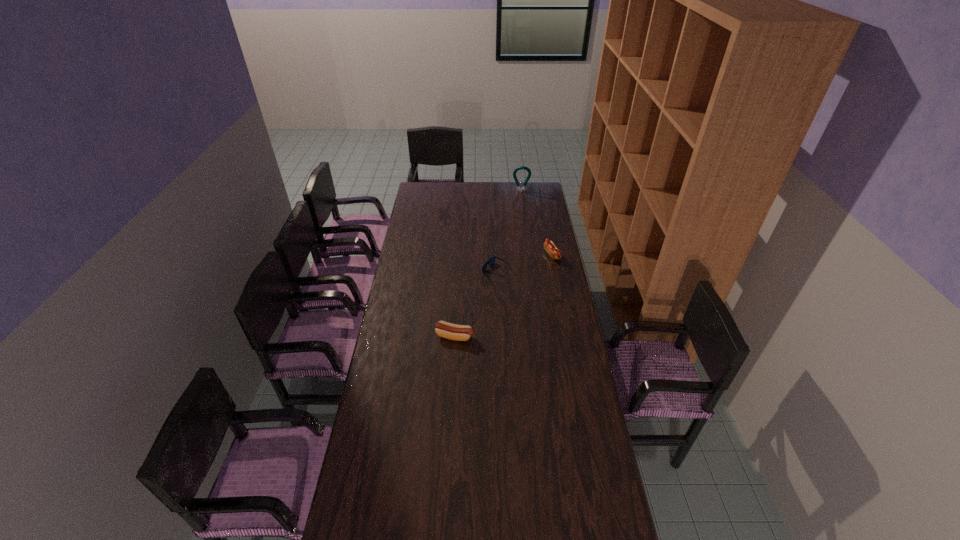
You are a GUI agent. You are given a task and a screenshot of the screen. Output one action in this format:
    pyautogui.click(x=<x>, y=<y>)
    Task: Click on the free space at the far right corner of the desktop
    The height and width of the screenshot is (540, 960).
    Given the screenshot: What is the action you would take?
    pyautogui.click(x=535, y=184)

Image resolution: width=960 pixels, height=540 pixels. In order to click on vacant space that is in between the farther sausage and the bottle opener in this screenshot , I will do `click(537, 223)`.

Locate an element on the screen. The width and height of the screenshot is (960, 540). vacant space in between the right sausage and the second object from left to right is located at coordinates pos(524,263).

This screenshot has width=960, height=540. Find the location of `vacant region between the right sausage and the nearest object`. vacant region between the right sausage and the nearest object is located at coordinates (504, 295).

Locate an element on the screen. free area in between the bottle opener and the third object from right to left is located at coordinates (509, 231).

The width and height of the screenshot is (960, 540). I want to click on free spot between the shortest object and the farther sausage, so [524, 263].

Locate an element on the screen. vacant region between the right sausage and the sunglasses is located at coordinates (524, 263).

Where is `object that stands as the third closest to the tallest object`? Image resolution: width=960 pixels, height=540 pixels. object that stands as the third closest to the tallest object is located at coordinates (443, 329).

Locate which object is the closest to the shortest object. Please provide its 2D coordinates. Your answer should be formatted as a tuple, i.e. [(x, y)], where the tuple contains the x and y coordinates of a point satisfying the conditions above.

[(549, 246)]

Locate an element on the screen. Image resolution: width=960 pixels, height=540 pixels. sausage that is the second closest to the sunglasses is located at coordinates (443, 329).